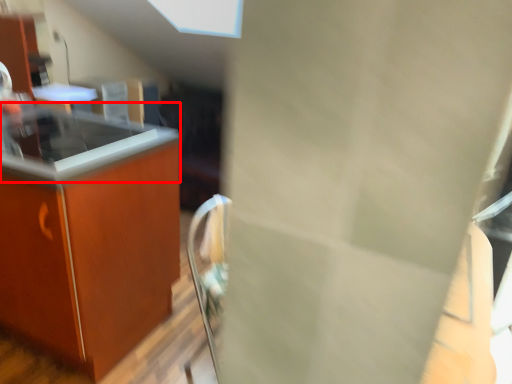
Question: From the image, what is the correct spatial relationship of countertop (annotated by the red box) in relation to countertop?

Choices:
 (A) left
 (B) right

Answer: (B)